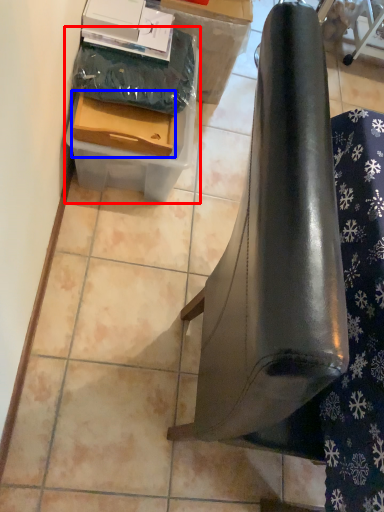
Question: Which of the following is the farthest to the observer, cardboard box (highlighted by a red box) or drawer (highlighted by a blue box)?

Choices:
 (A) cardboard box
 (B) drawer

Answer: (A)